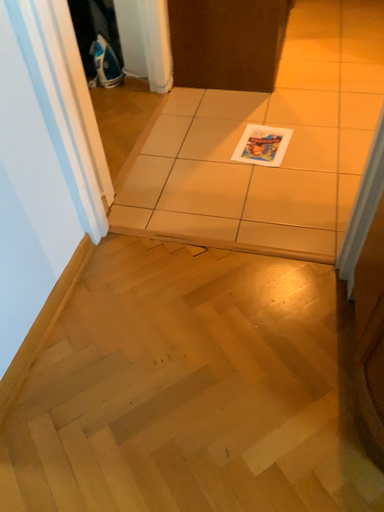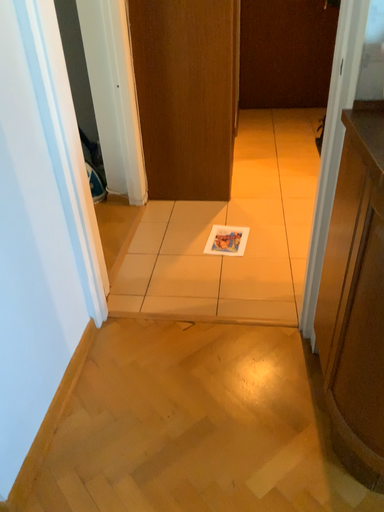
Question: How did the camera likely rotate when shooting the video?

Choices:
 (A) rotated downward
 (B) rotated upward

Answer: (B)